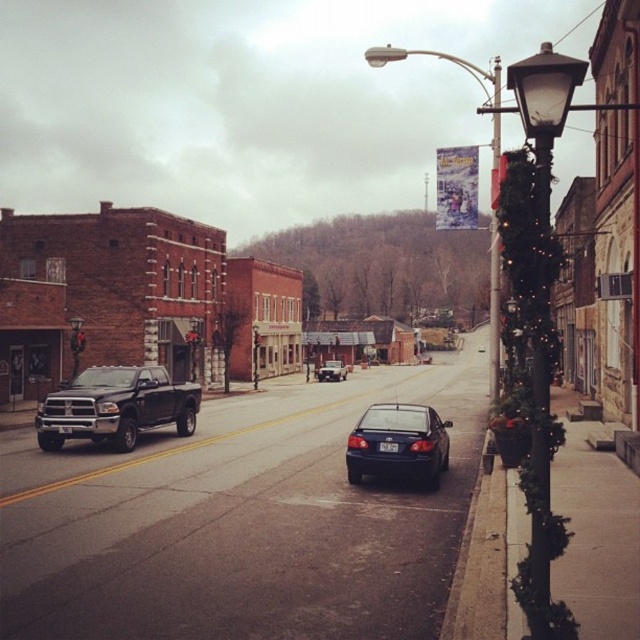
Question: Which object appears closest to the camera in this image?

Choices:
 (A) metallic streetlight at center
 (B) metallic streetlight at left

Answer: (A)

Question: Which point is farther to the camera?

Choices:
 (A) (490, 307)
 (B) (188, 413)

Answer: (A)

Question: Does black glass lamp post at right appear over metallic streetlight at left?

Choices:
 (A) yes
 (B) no

Answer: (A)

Question: Can you confirm if matte black truck at left is wider than matte blue sedan at center?

Choices:
 (A) no
 (B) yes

Answer: (B)

Question: Considering the real-world distances, which object is closest to the metallic streetlight at center?

Choices:
 (A) metallic streetlight at left
 (B) brown brick building at left

Answer: (B)

Question: Can you confirm if brown brick building at left is thinner than shiny silver sedan at center?

Choices:
 (A) no
 (B) yes

Answer: (A)